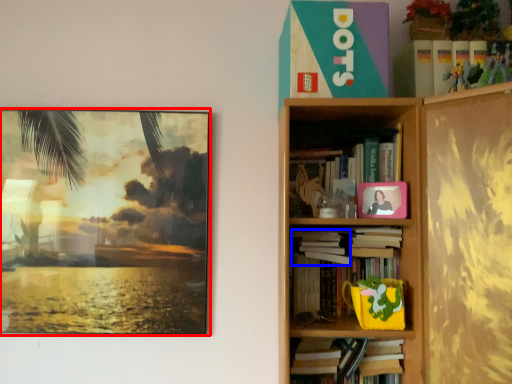
Question: Among these objects, which one is farthest to the camera, picture frame (highlighted by a red box) or book (highlighted by a blue box)?

Choices:
 (A) picture frame
 (B) book

Answer: (A)